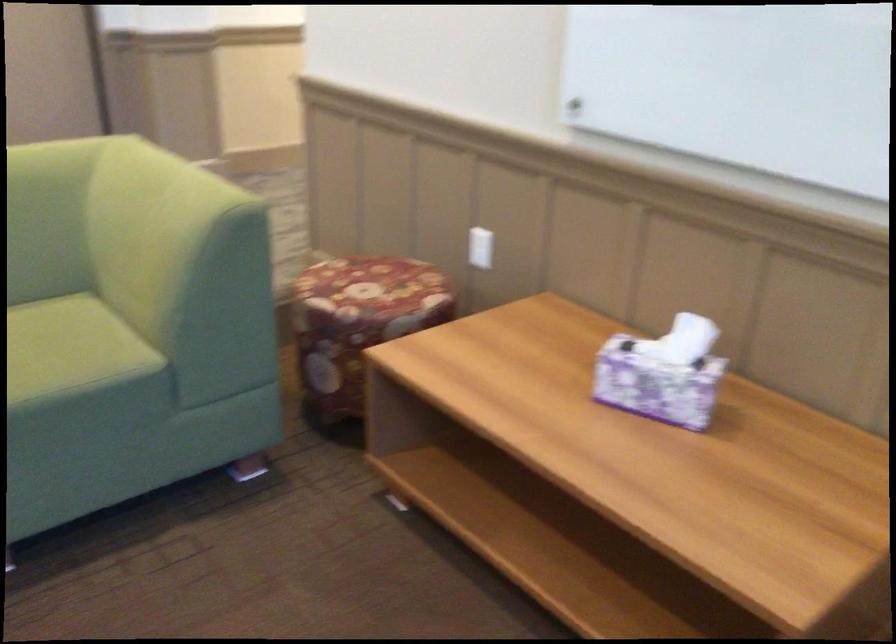
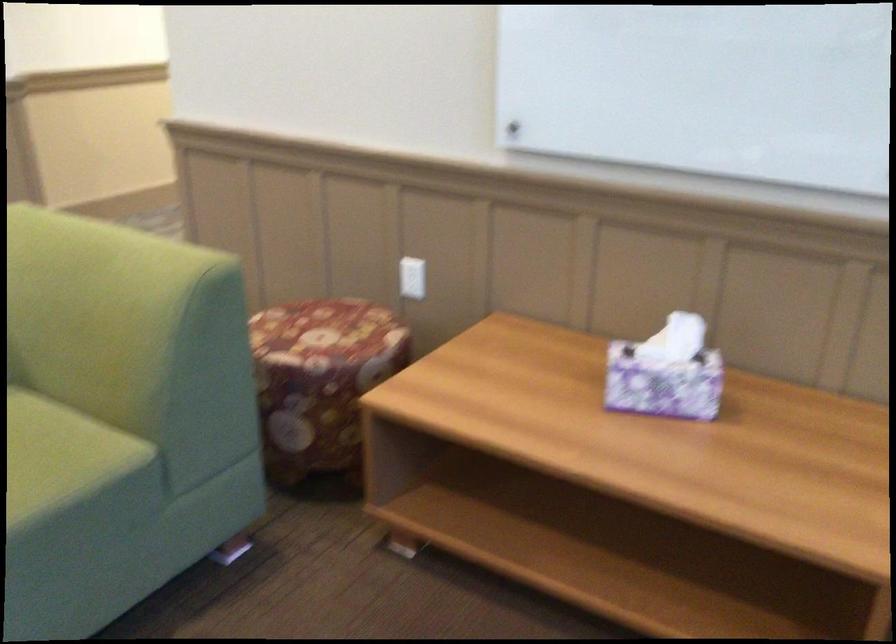
Question: Which direction would the cameraman need to move to produce the second image? Reply with the corresponding letter.

Choices:
 (A) Left
 (B) Right
 (C) Forward
 (D) Backward

Answer: (A)